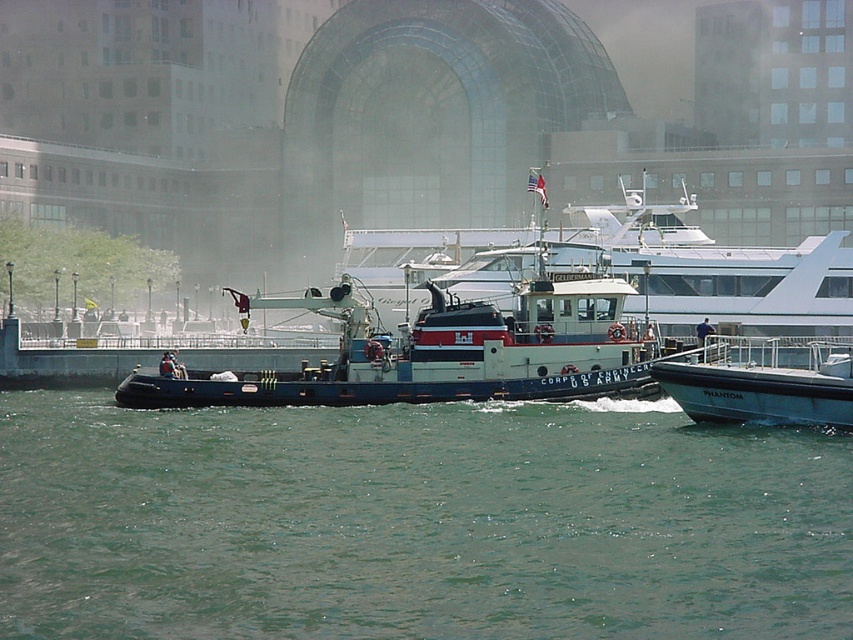
You are a maritime engineer observing the waterfront scene. You need to determine which tugboat, the blue matte tugboat at center or the white glossy tugboat at center, can more easily maneuver in tight spaces. Based on their sizes, which one would you recommend?

The blue matte tugboat at center is smaller than the white glossy tugboat at center, so it can more easily maneuver in tight spaces.

Based on the coordinates provided, what is located at point (x=416, y=522) in the image?

The point (x=416, y=522) indicates greenish water at center.